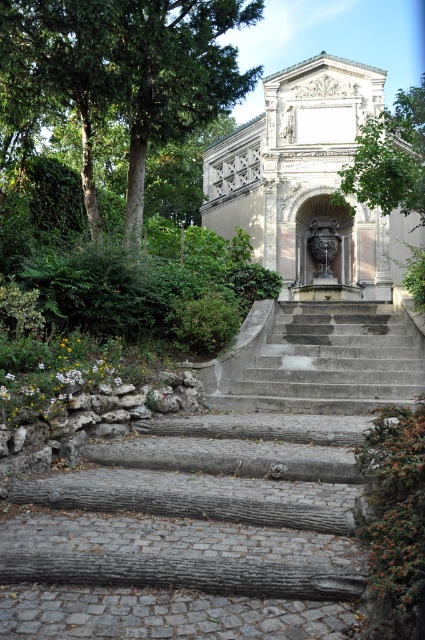
Question: Among these objects, which one is nearest to the camera?

Choices:
 (A) green leafy tree at upper left
 (B) green leafy tree at center

Answer: (A)

Question: Estimate the real-world distances between objects in this image. Which object is farther from the green leafy tree at center?

Choices:
 (A) gray concrete stairs at center
 (B) stone fountain at center

Answer: (A)

Question: Is gray concrete stairs at center further to the viewer compared to green leafy tree at center?

Choices:
 (A) no
 (B) yes

Answer: (A)

Question: Considering the real-world distances, which object is closest to the stone fountain at center?

Choices:
 (A) gray concrete stairs at center
 (B) green leafy tree at upper left
 (C) green leafy tree at center

Answer: (C)

Question: Is green leafy tree at upper left bigger than green leafy tree at center?

Choices:
 (A) no
 (B) yes

Answer: (A)

Question: Does green leafy tree at upper left lie in front of green leafy tree at center?

Choices:
 (A) yes
 (B) no

Answer: (A)